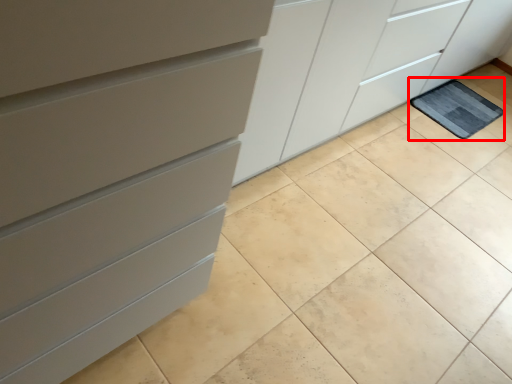
Question: From the image's perspective, considering the relative positions of bath mat (annotated by the red box) and chest of drawers in the image provided, where is bath mat (annotated by the red box) located with respect to the staircase?

Choices:
 (A) below
 (B) above

Answer: (B)